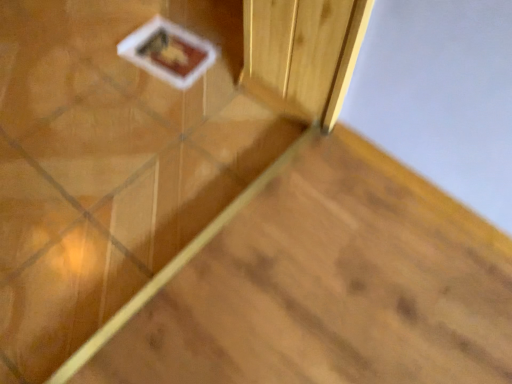
Describe the element at coordinates (140, 148) in the screenshot. I see `wooden door at upper center` at that location.

The height and width of the screenshot is (384, 512). In order to click on wooden door at upper center in this screenshot , I will do `click(140, 148)`.

This screenshot has width=512, height=384. I want to click on wooden door at upper center, so click(140, 148).